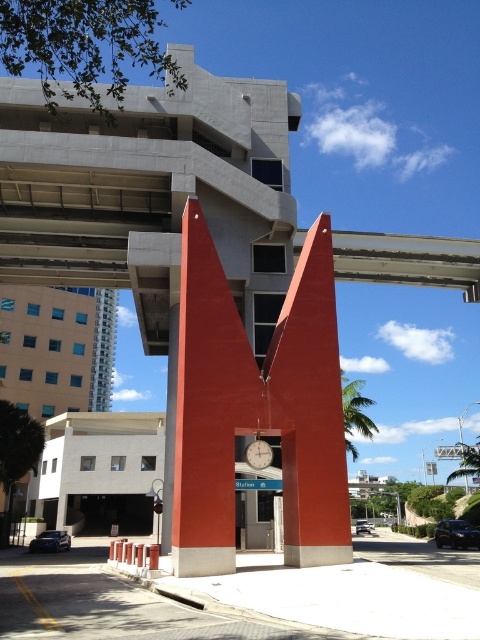
You are standing at the camera position in the urban scene. There is a point marked at coordinates point (183, 308). Can you walk directly to this point without any obstacles?

The point (183, 308) is 15.83 meters away from the camera position. Since there are no obstacles mentioned between the camera and the point, you can walk directly to it.

From the picture: You are a maintenance worker needing to reach both the smooth red pillar at center and the metallic silver clock at center. If your ladder is 2.5 meters long, can you use it to reach both objects without moving the ladder?

The smooth red pillar at center and metallic silver clock at center are 2.42 meters apart from each other. Since the ladder is 2.5 meters long, it can span the distance between them, allowing you to reach both objects without moving the ladder.

You are a maintenance worker needing to inspect both the smooth orange pillar at center and the metallic silver clock at center. Based on their positions, which object do you need to climb higher to reach?

The smooth orange pillar at center is above the metallic silver clock at center, so you need to climb higher to reach the smooth orange pillar at center.